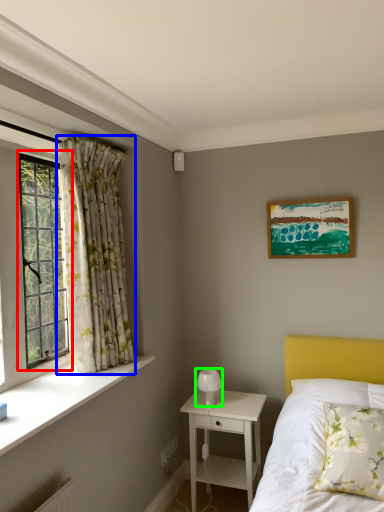
Question: Which object is positioned farthest from window (highlighted by a red box)? Select from curtain (highlighted by a blue box) and table lamp (highlighted by a green box).

Choices:
 (A) curtain
 (B) table lamp

Answer: (B)